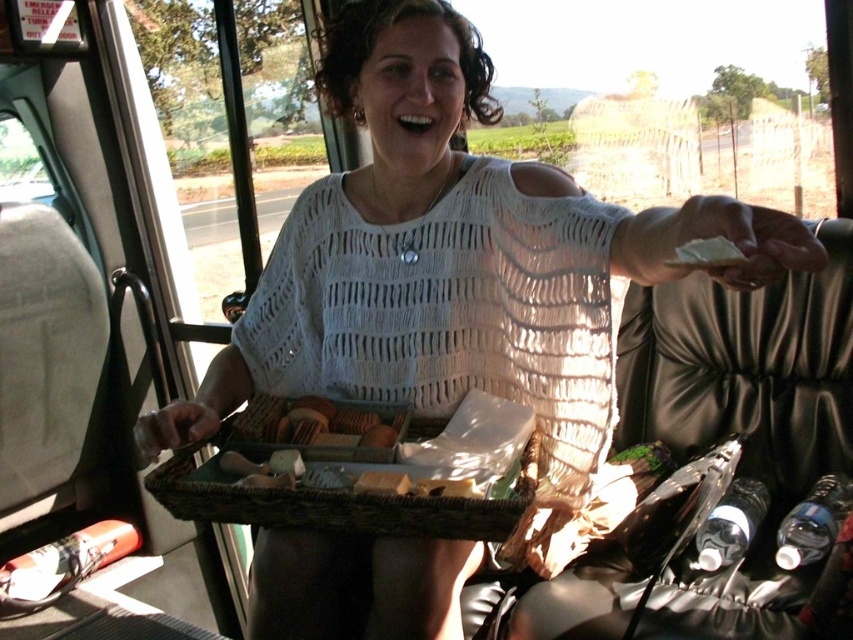
You are a passenger on a bus and you see a woven brown basket at center and a white matte bread at upper right on the tray. Which item is located higher up on the tray?

The white matte bread at upper right is located higher up on the tray because the woven brown basket at center is below it.

You are a passenger on a bus and see a tray with a woven brown basket at center and a white matte bread at upper right. Which item is closer to you?

The woven brown basket at center is closer to you because the white matte bread at upper right is behind it.